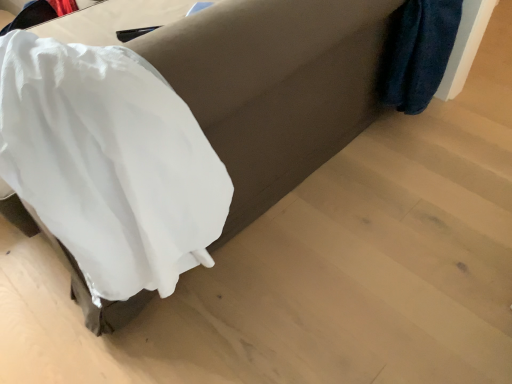
Question: Based on their positions, is white fabric at lower left located to the left or right of white fabric at lower left?

Choices:
 (A) left
 (B) right

Answer: (A)

Question: From the image's perspective, relative to white fabric at lower left, is white fabric at lower left above or below?

Choices:
 (A) below
 (B) above

Answer: (A)

Question: In terms of size, does white fabric at lower left appear bigger or smaller than white fabric at lower left?

Choices:
 (A) big
 (B) small

Answer: (B)

Question: In terms of size, does white fabric at lower left appear bigger or smaller than white fabric at lower left?

Choices:
 (A) small
 (B) big

Answer: (B)

Question: From the image's perspective, is white fabric at lower left located above or below white fabric at lower left?

Choices:
 (A) above
 (B) below

Answer: (A)

Question: From a real-world perspective, is white fabric at lower left positioned above or below white fabric at lower left?

Choices:
 (A) below
 (B) above

Answer: (A)

Question: From their relative heights in the image, would you say white fabric at lower left is taller or shorter than white fabric at lower left?

Choices:
 (A) tall
 (B) short

Answer: (A)